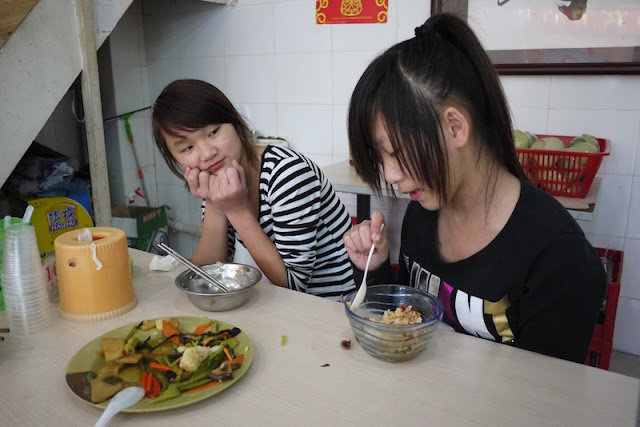
Locate an element on the screen. The width and height of the screenshot is (640, 427). small stainless steel silver bowl is located at coordinates (203, 297).